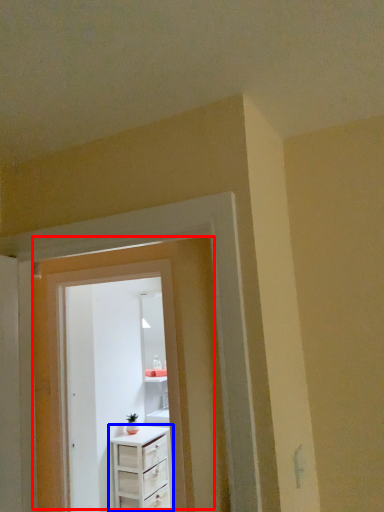
Question: Which of the following is the farthest to the observer, door (highlighted by a red box) or chest of drawers (highlighted by a blue box)?

Choices:
 (A) door
 (B) chest of drawers

Answer: (B)